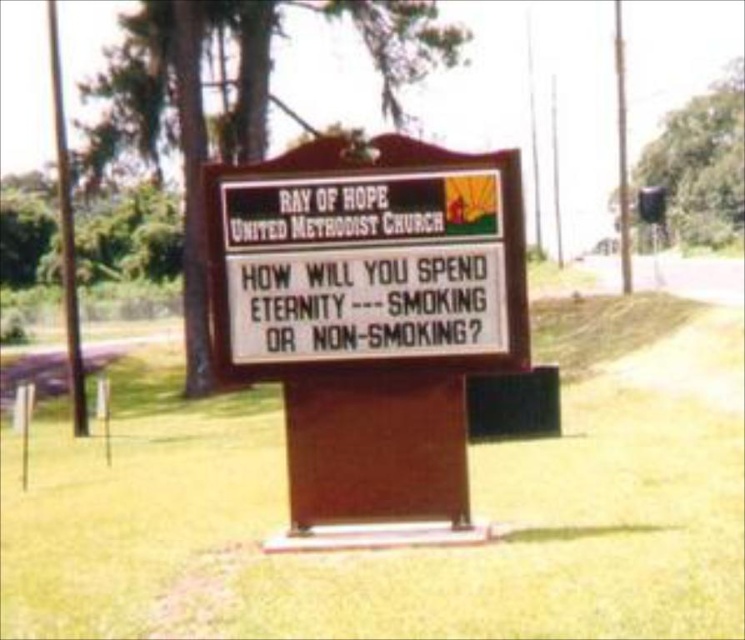
Question: From the image, what is the correct spatial relationship of green grass at center in relation to wooden signboard at center?

Choices:
 (A) above
 (B) below

Answer: (B)

Question: Is green grass at center smaller than wooden signboard at center?

Choices:
 (A) yes
 (B) no

Answer: (B)

Question: Is green grass at center wider than wooden signboard at center?

Choices:
 (A) yes
 (B) no

Answer: (A)

Question: Which of the following is the farthest from the observer?

Choices:
 (A) wooden signboard at center
 (B) green grass at center

Answer: (A)